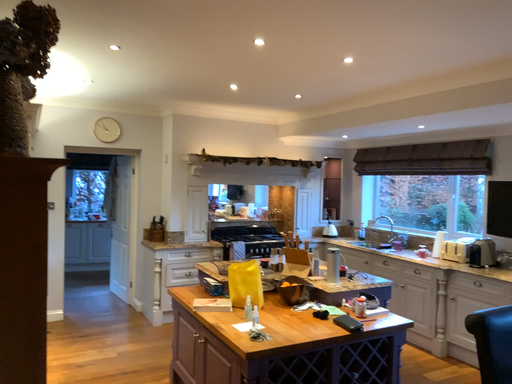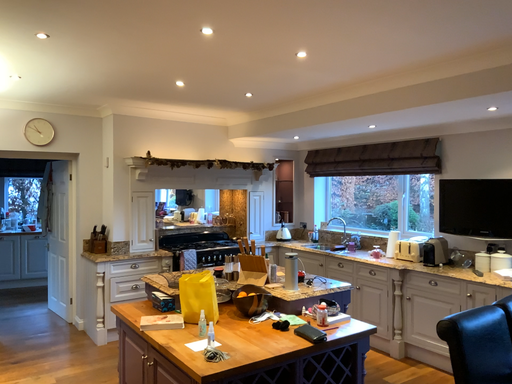
Question: Which way did the camera rotate in the video?

Choices:
 (A) rotated right
 (B) rotated left

Answer: (A)